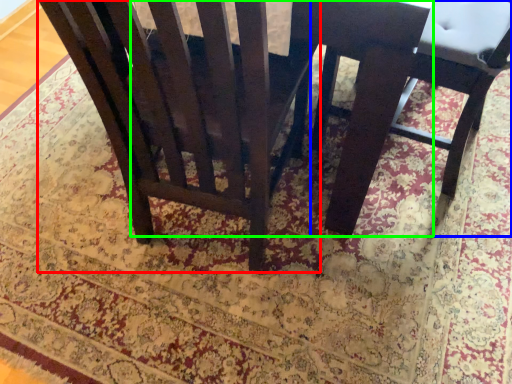
Question: Based on their relative distances, which object is nearer to chair (highlighted by a red box)? Choose from chair (highlighted by a blue box) and round table (highlighted by a green box).

Choices:
 (A) chair
 (B) round table

Answer: (B)